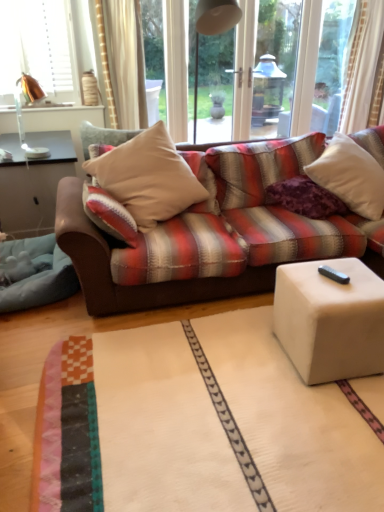
Question: Is copper metallic table lamp at upper left facing away from purple velvet pillow at center, marked as the second pillow in a left-to-right arrangement?

Choices:
 (A) yes
 (B) no

Answer: (B)

Question: Is copper metallic table lamp at upper left at the left side of purple velvet pillow at center, marked as the second pillow in a left-to-right arrangement?

Choices:
 (A) yes
 (B) no

Answer: (A)

Question: Is copper metallic table lamp at upper left further to the viewer compared to purple velvet pillow at center, marked as the second pillow in a left-to-right arrangement?

Choices:
 (A) no
 (B) yes

Answer: (B)

Question: From the image's perspective, is copper metallic table lamp at upper left located above purple velvet pillow at center, the 2th pillow from the right?

Choices:
 (A) yes
 (B) no

Answer: (A)

Question: Is purple velvet pillow at center, marked as the second pillow in a left-to-right arrangement, a part of copper metallic table lamp at upper left?

Choices:
 (A) yes
 (B) no

Answer: (B)

Question: In the image, is white matte cube at lower right positioned in front of or behind purple velvet pillow at center, the 2th pillow from the right?

Choices:
 (A) front
 (B) behind

Answer: (A)

Question: From the image's perspective, is white matte cube at lower right positioned above or below purple velvet pillow at center, marked as the second pillow in a left-to-right arrangement?

Choices:
 (A) below
 (B) above

Answer: (A)

Question: Is white matte cube at lower right wider or thinner than purple velvet pillow at center, the 2th pillow from the right?

Choices:
 (A) wide
 (B) thin

Answer: (B)

Question: Considering the positions of white matte cube at lower right and purple velvet pillow at center, marked as the second pillow in a left-to-right arrangement, in the image, is white matte cube at lower right taller or shorter than purple velvet pillow at center, marked as the second pillow in a left-to-right arrangement,?

Choices:
 (A) short
 (B) tall

Answer: (B)

Question: From the image's perspective, is beige fabric pillow at center, which is the 3th pillow from right to left, above or below blue soft fabric at lower left?

Choices:
 (A) above
 (B) below

Answer: (A)

Question: In terms of height, does beige fabric pillow at center, the 1th pillow viewed from the left, look taller or shorter compared to blue soft fabric at lower left?

Choices:
 (A) short
 (B) tall

Answer: (B)

Question: In terms of size, does beige fabric pillow at center, which is the 3th pillow from right to left, appear bigger or smaller than blue soft fabric at lower left?

Choices:
 (A) small
 (B) big

Answer: (B)

Question: Is beige fabric pillow at center, which is the 3th pillow from right to left, situated inside blue soft fabric at lower left or outside?

Choices:
 (A) outside
 (B) inside

Answer: (A)

Question: Is white matte cube at lower right to the left or to the right of white soft cushion at upper right, the 3th pillow positioned from the left, in the image?

Choices:
 (A) right
 (B) left

Answer: (B)

Question: Relative to white soft cushion at upper right, the 3th pillow positioned from the left, is white matte cube at lower right in front or behind?

Choices:
 (A) front
 (B) behind

Answer: (A)